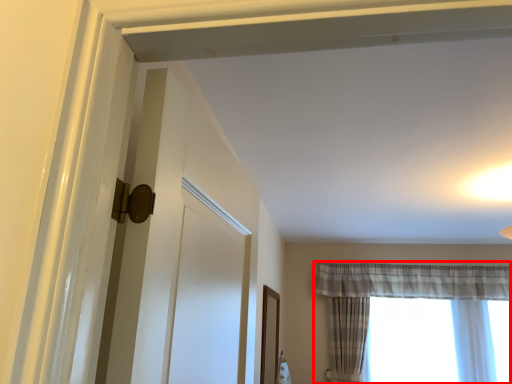
Question: Considering the relative positions of curtain (annotated by the red box) and window in the image provided, where is curtain (annotated by the red box) located with respect to the staircase?

Choices:
 (A) right
 (B) left

Answer: (B)